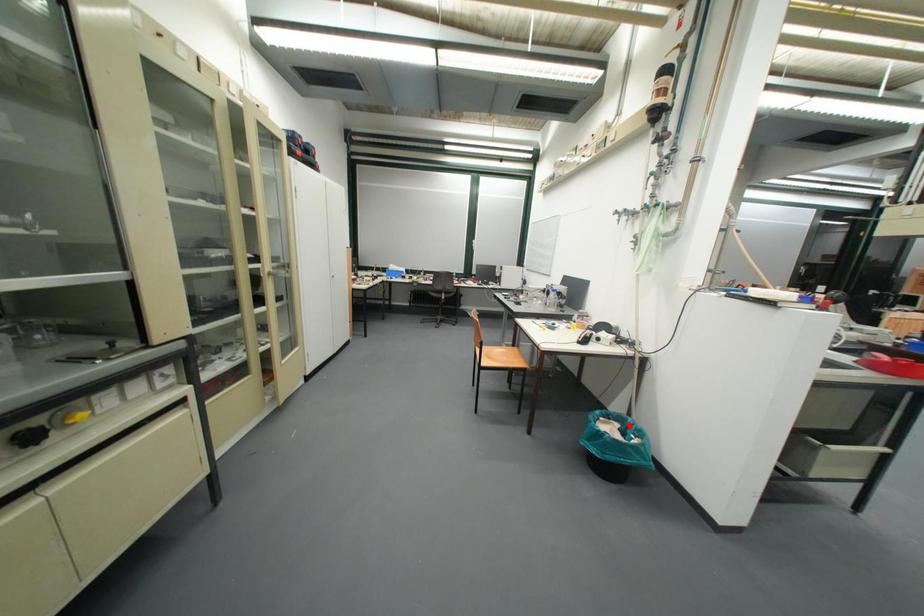
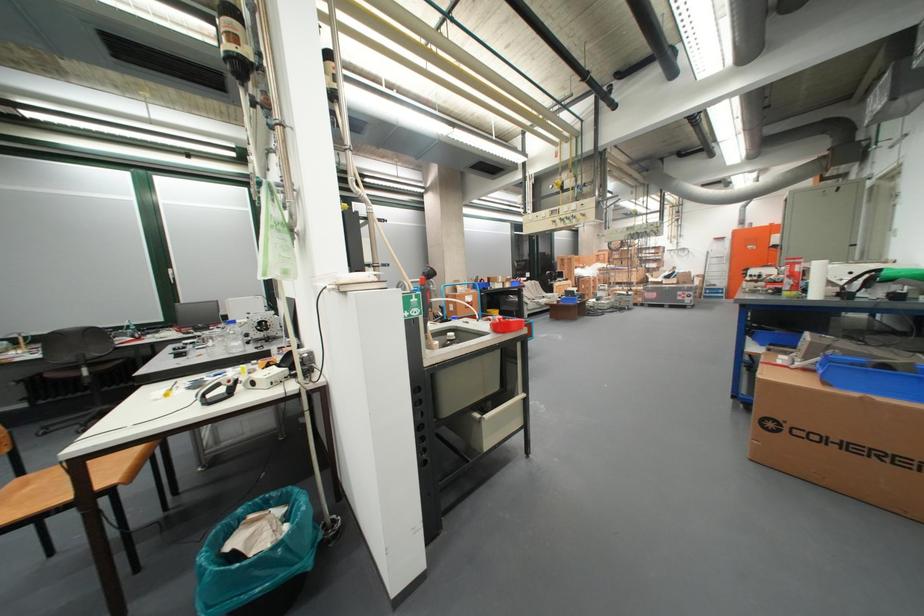
Question: I am providing you with two images of the same scene from different viewpoints. In image1, a red point is highlighted. Considering the same 3D point in image2, which of the following is correct?

Choices:
 (A) It is closer
 (B) It is farther

Answer: (B)